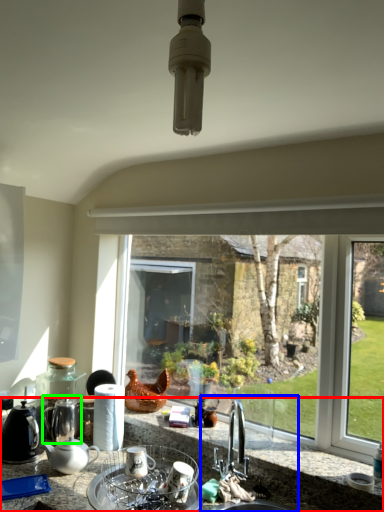
Question: Which is nearer to the countertop (highlighted by a red box)? sink (highlighted by a blue box) or tea pot (highlighted by a green box).

Choices:
 (A) sink
 (B) tea pot

Answer: (A)